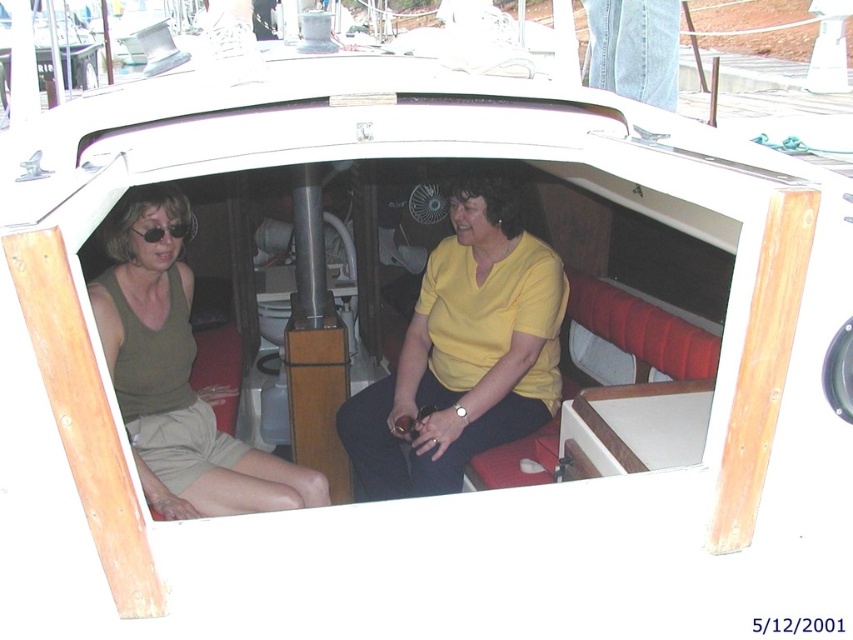
Does yellow matte shirt at center have a smaller size compared to matte green tank top at left?

Incorrect, yellow matte shirt at center is not smaller in size than matte green tank top at left.

Is yellow matte shirt at center to the left of matte green tank top at left from the viewer's perspective?

No, yellow matte shirt at center is not to the left of matte green tank top at left.

Does point (424, 449) come behind point (256, 458)?

Yes, point (424, 449) is behind point (256, 458).

The height and width of the screenshot is (640, 853). In order to click on yellow matte shirt at center in this screenshot , I will do `click(463, 353)`.

Between point (103, 340) and point (173, 221), which one is positioned behind?

Positioned behind is point (173, 221).

From the picture: Is matte green tank top at left to the right of matte black sunglasses at left from the viewer's perspective?

Indeed, matte green tank top at left is positioned on the right side of matte black sunglasses at left.

Between point (247, 465) and point (184, 224), which one is positioned in front?

Positioned in front is point (184, 224).

Image resolution: width=853 pixels, height=640 pixels. Identify the location of matte green tank top at left. (177, 378).

How much distance is there between yellow matte shirt at center and matte black sunglasses at left?

yellow matte shirt at center and matte black sunglasses at left are 38.85 inches apart from each other.

Is point (426, 442) farther from camera compared to point (190, 228)?

That is False.

What are the coordinates of `yellow matte shirt at center` in the screenshot? It's located at (463, 353).